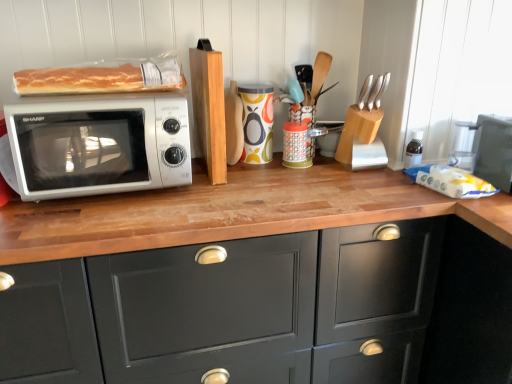
In order to click on free spot to the left of wooden knife block at upper right, the second appliance viewed from the right in this screenshot , I will do `click(320, 170)`.